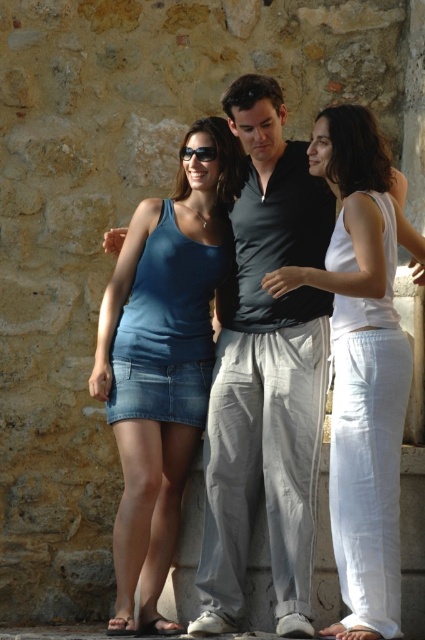
Question: Which object is positioned closest to the denim skirt at center?

Choices:
 (A) white cotton tank top at center
 (B) blue denim skirt at center

Answer: (B)

Question: Considering the relative positions of blue denim skirt at center and denim skirt at center in the image provided, where is blue denim skirt at center located with respect to denim skirt at center?

Choices:
 (A) above
 (B) below

Answer: (A)

Question: Observing the image, what is the correct spatial positioning of denim skirt at center in reference to white cotton tank top at center?

Choices:
 (A) below
 (B) above

Answer: (A)

Question: Which of the following is the farthest from the observer?

Choices:
 (A) (376, 353)
 (B) (200, 157)

Answer: (B)

Question: Is white cotton tank top at center smaller than black plastic sunglasses at center?

Choices:
 (A) no
 (B) yes

Answer: (A)

Question: Which object appears closest to the camera in this image?

Choices:
 (A) black plastic sunglasses at center
 (B) denim skirt at center

Answer: (B)